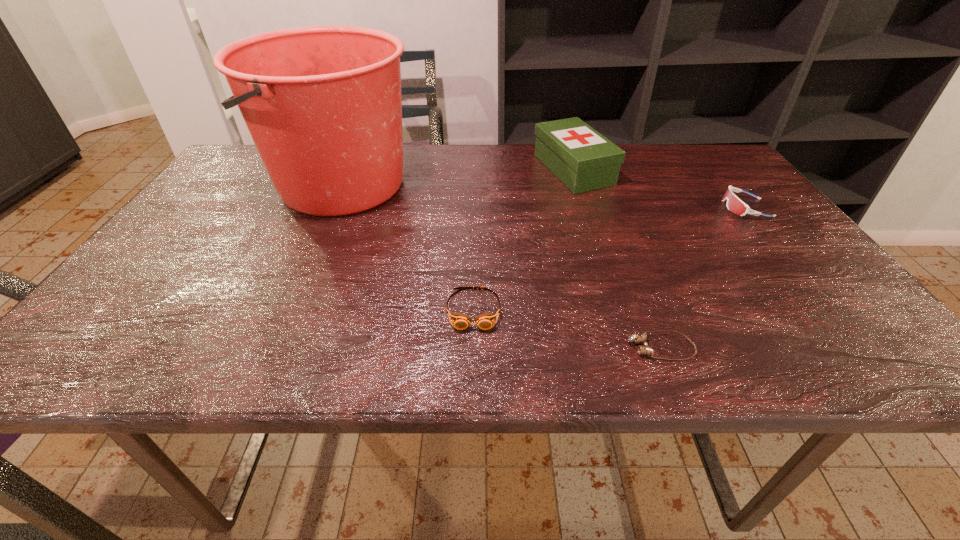
Where is `object that ranks as the second closest to the leftmost object`? object that ranks as the second closest to the leftmost object is located at coordinates (581, 158).

What are the coordinates of `goggles object that ranks as the third closest to the leftmost object` in the screenshot? It's located at point(734,204).

You are a GUI agent. You are given a task and a screenshot of the screen. Output one action in this format:
    pyautogui.click(x=<x>, y=<y>)
    Task: Click on the goggles identified as the second closest to the farthest goggles
    
    Given the screenshot: What is the action you would take?
    pyautogui.click(x=459, y=321)

You are a GUI agent. You are given a task and a screenshot of the screen. Output one action in this format:
    pyautogui.click(x=<x>, y=<y>)
    Task: Click on the free spot that satisfies the following two spatial constraints: 1. on the back side of the bucket; 2. on the right side of the first-aid kit
    
    Given the screenshot: What is the action you would take?
    pyautogui.click(x=348, y=170)

Locate an element on the screen. free spot that satisfies the following two spatial constraints: 1. on the front-facing side of the rightmost object; 2. with the lenses facing forward on the second shortest goggles is located at coordinates (828, 309).